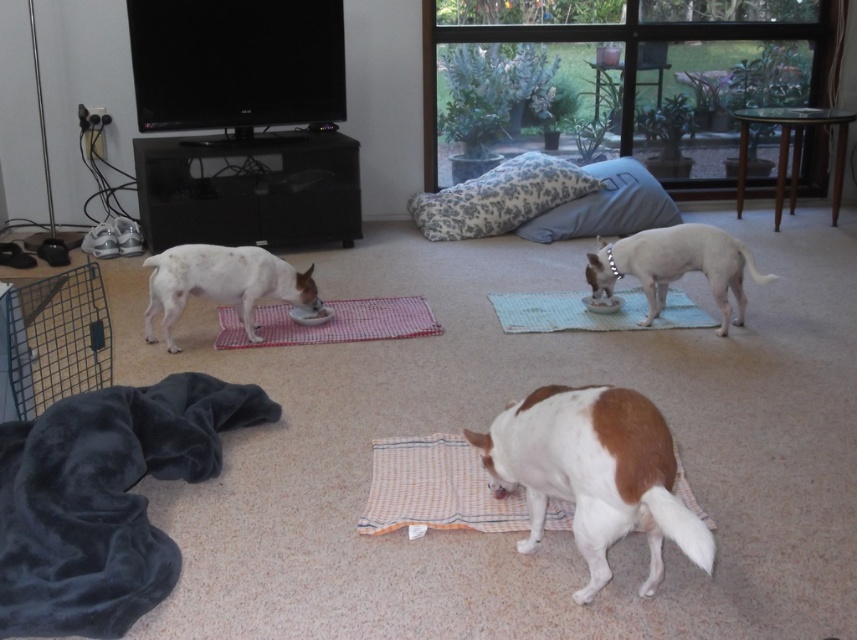
Question: Does light blue fabric pillow at center appear on the right side of red checkered yoga mat at center?

Choices:
 (A) yes
 (B) no

Answer: (A)

Question: Estimate the real-world distances between objects in this image. Which object is farther from the green fabric yoga mat at center?

Choices:
 (A) fluffy white pillow at center
 (B) light blue fabric pillow at center

Answer: (A)

Question: Where is brown and white fur at center located in relation to green fabric yoga mat at center in the image?

Choices:
 (A) below
 (B) above

Answer: (A)

Question: Which of these objects is positioned farthest from the orange woven mat at center?

Choices:
 (A) brown and white fur at center
 (B) white speckled fur at left
 (C) red checkered yoga mat at center
 (D) green fabric yoga mat at center

Answer: (D)

Question: Is fluffy white pillow at center to the left of light blue fabric pillow at center from the viewer's perspective?

Choices:
 (A) no
 (B) yes

Answer: (B)

Question: Estimate the real-world distances between objects in this image. Which object is farther from the metal wire cage at left?

Choices:
 (A) white smooth dog at center
 (B) fluffy white pillow at center
 (C) green fabric yoga mat at center
 (D) white speckled fur at left

Answer: (A)